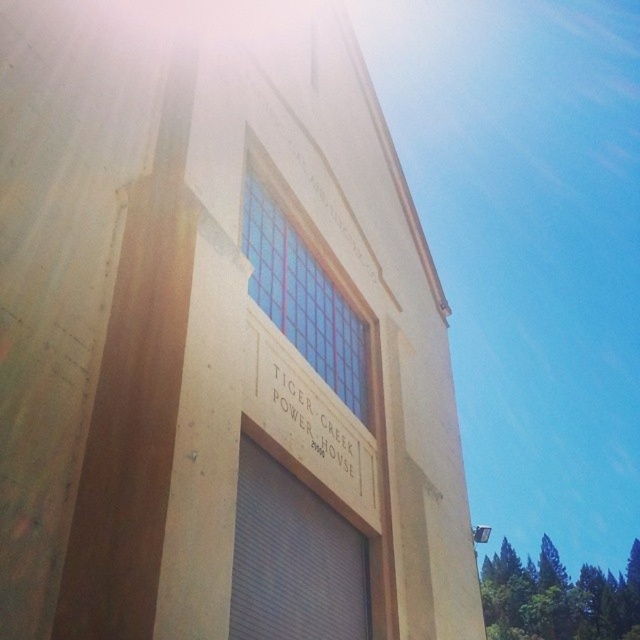
You are standing in front of the building and want to take a photo. There are two points marked on the building facade. The first point is at coordinate point (x=333, y=620) and the second is at point (x=294, y=371). Which point appears closer to you in the photo?

Point (x=333, y=620) is closer to the camera than point (x=294, y=371), so it appears closer in the photo.

You are standing in front of the building and want to enter the gray metallic garage door at center. However, you notice the white wood tiger creek power house at center might be blocking your path. Can you walk directly to the garage door without going around?

The gray metallic garage door at center is closer to the viewer than the white wood tiger creek power house at center, so you can walk directly to the garage door without obstruction from the power house.